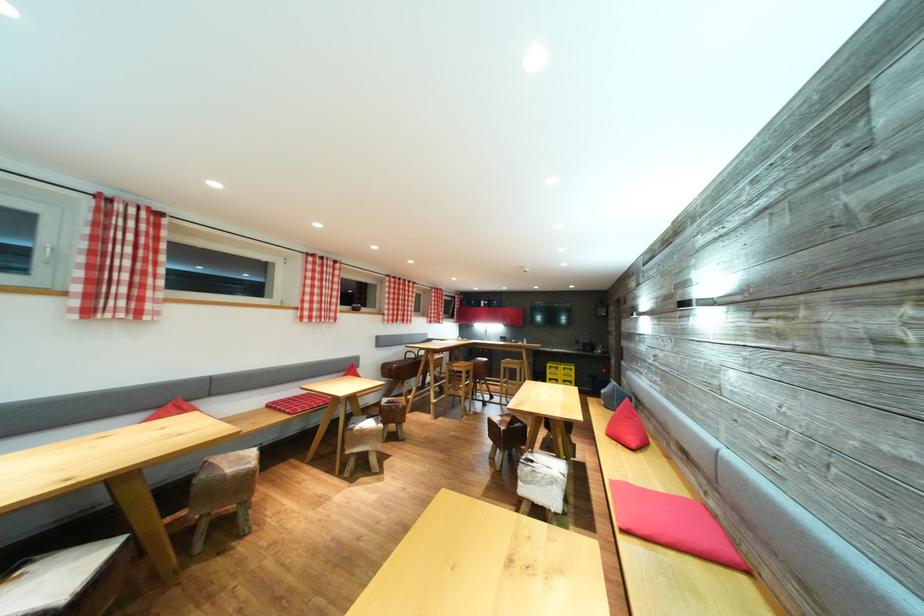
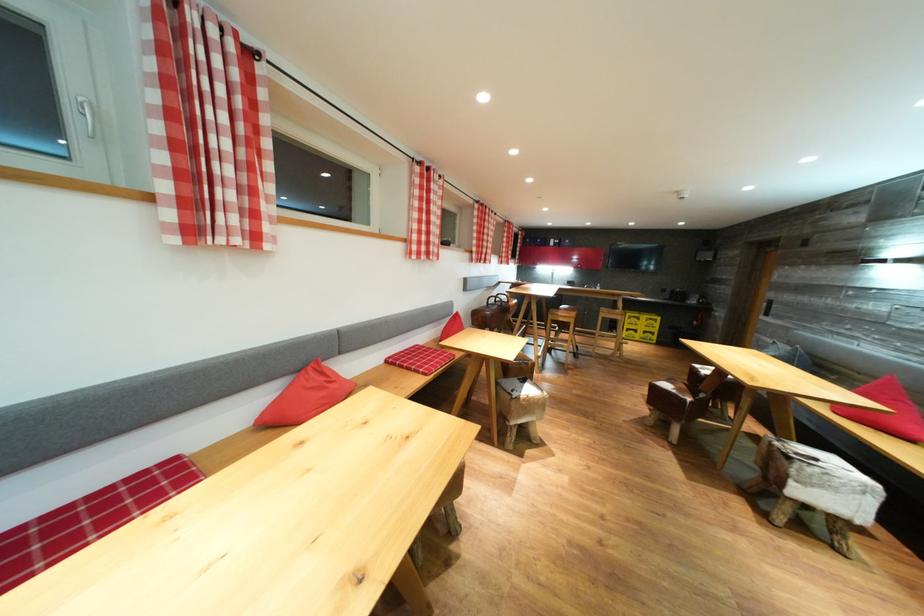
Question: I am providing you with two images of the same scene from different viewpoints. Please identify which objects are invisible in image2.

Choices:
 (A) red pillow
 (B) yellow cardboard box
 (C) checkered seat cushion
 (D) none of these

Answer: (D)